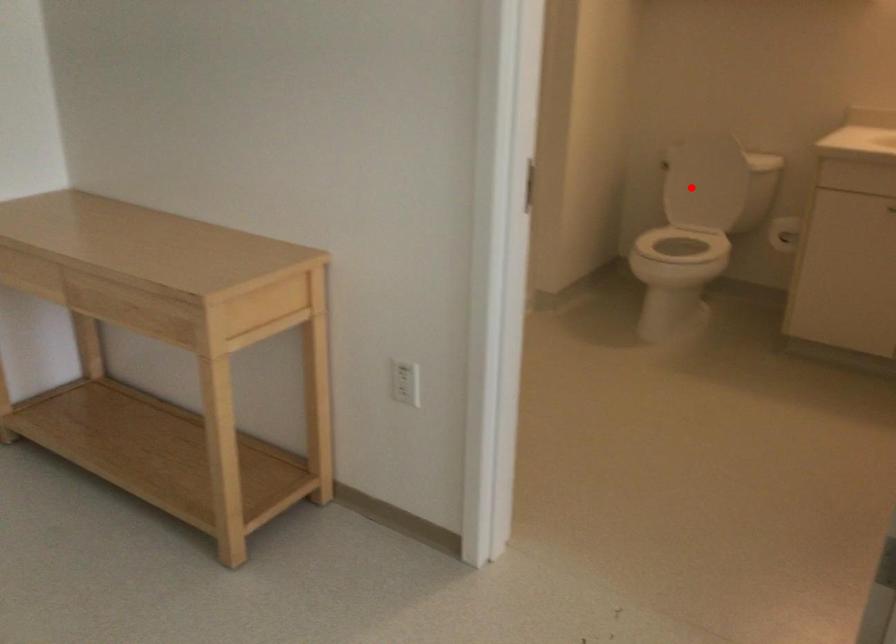
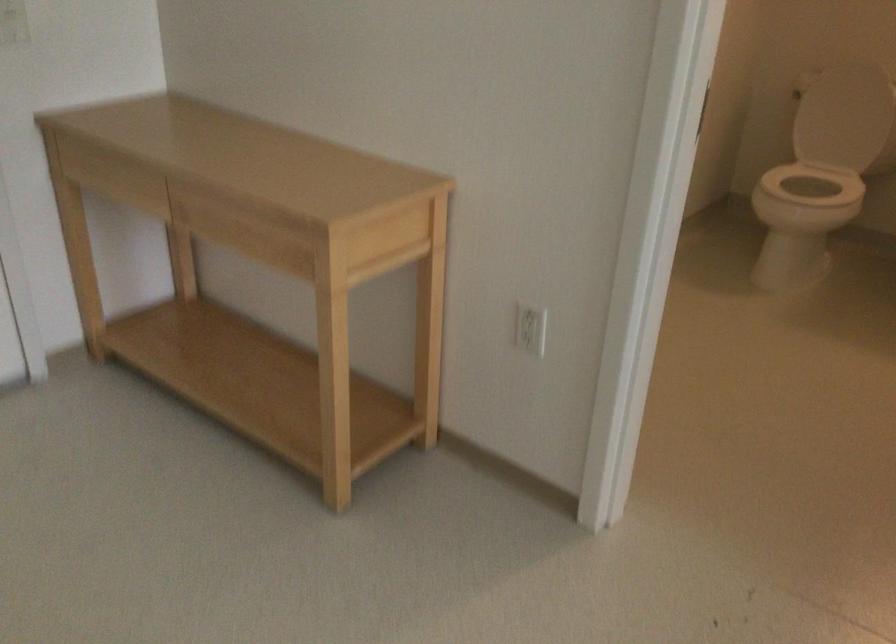
Where in the second image is the point corresponding to the highlighted location from the first image?

(839, 118)